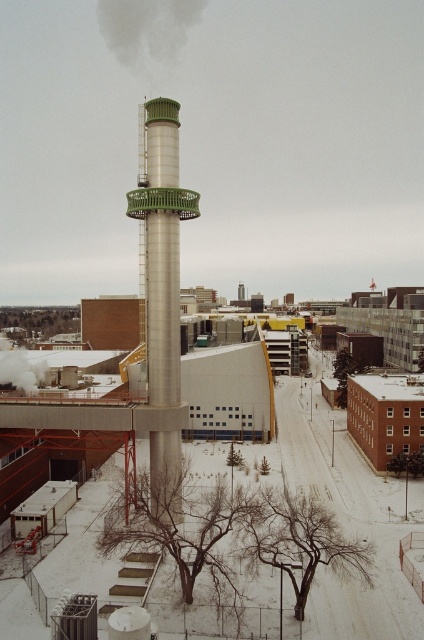
Between silver metallic tower at center and white smoke at center, which one appears on the left side from the viewer's perspective?

Positioned to the left is white smoke at center.

Can you confirm if silver metallic tower at center is thinner than white smoke at center?

Correct, silver metallic tower at center's width is less than white smoke at center's.

Where is `silver metallic tower at center`? silver metallic tower at center is located at coordinates (161, 248).

Which is below, silver metallic tower at center or gray matte smoke at upper center?

silver metallic tower at center is lower down.

What do you see at coordinates (161, 248) in the screenshot? I see `silver metallic tower at center` at bounding box center [161, 248].

At what (x,y) coordinates should I click in order to perform the action: click on silver metallic tower at center. Please return your answer as a coordinate pair (x, y). The width and height of the screenshot is (424, 640). Looking at the image, I should click on (161, 248).

Does gray matte smoke at upper center have a larger size compared to white smoke at center?

Yes.

Consider the image. Does gray matte smoke at upper center have a greater height compared to white smoke at center?

Correct, gray matte smoke at upper center is much taller as white smoke at center.

Identify the location of gray matte smoke at upper center. (147, 29).

Where is `gray matte smoke at upper center`? The height and width of the screenshot is (640, 424). gray matte smoke at upper center is located at coordinates (147, 29).